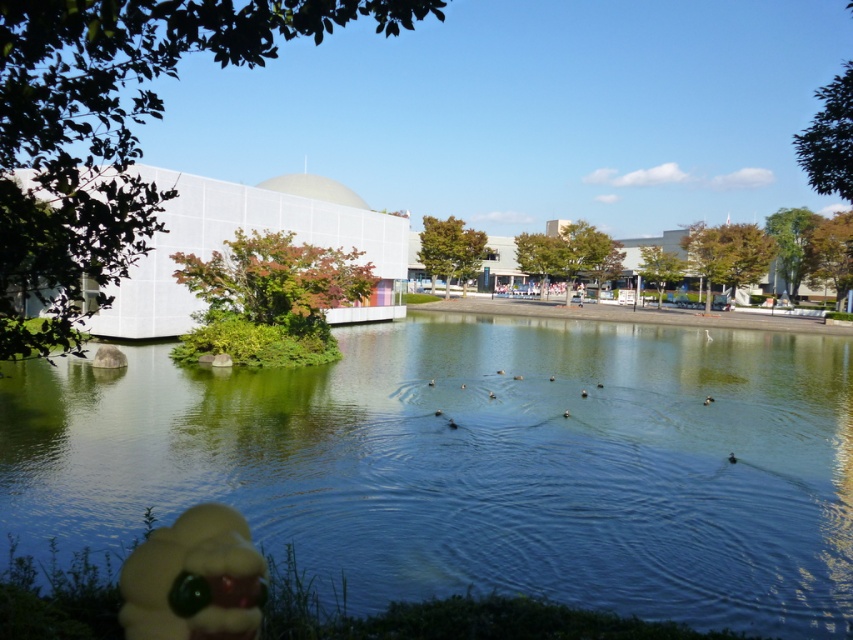
Looking at this image, between clear water at pond center and yellow rubber duck at lower left, which one appears on the right side from the viewer's perspective?

Positioned to the right is clear water at pond center.

Can you confirm if clear water at pond center is positioned above yellow rubber duck at lower left?

Correct, clear water at pond center is located above yellow rubber duck at lower left.

This screenshot has width=853, height=640. What do you see at coordinates (476, 464) in the screenshot?
I see `clear water at pond center` at bounding box center [476, 464].

Locate an element on the screen. The image size is (853, 640). clear water at pond center is located at coordinates (476, 464).